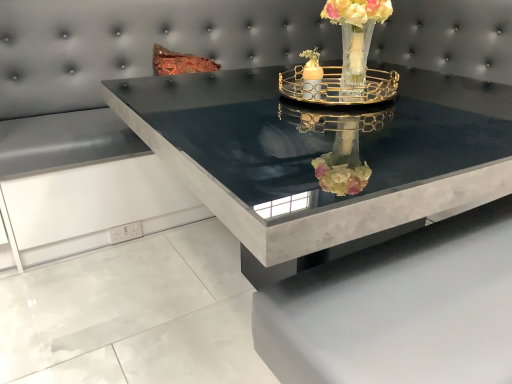
Question: Relative to black marble table at center, is matte glass candle holder at center, the first candle holder from the left, in front or behind?

Choices:
 (A) behind
 (B) front

Answer: (A)

Question: Looking at their shapes, would you say matte glass candle holder at center, the first candle holder from the left, is wider or thinner than black marble table at center?

Choices:
 (A) thin
 (B) wide

Answer: (A)

Question: Based on their relative distances, which object is nearer to the matte glass candle holder at center, the second candle holder in the right-to-left sequence?

Choices:
 (A) black marble table at center
 (B) translucent glass vase at upper center
 (C) gold metallic tray at center, marked as the 1th candle holder in a right-to-left arrangement

Answer: (C)

Question: Which object is the farthest from the matte glass candle holder at center, the second candle holder in the right-to-left sequence?

Choices:
 (A) translucent glass vase at upper center
 (B) gold metallic tray at center, marked as the 1th candle holder in a right-to-left arrangement
 (C) black marble table at center

Answer: (C)